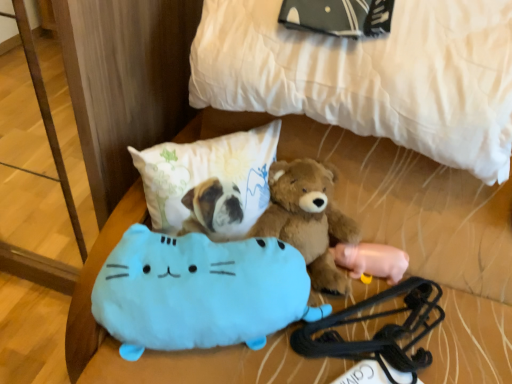
Question: Is white quilted bed at upper center wider than brown plush teddy bear at center?

Choices:
 (A) no
 (B) yes

Answer: (B)

Question: Is there a large distance between white quilted bed at upper center and brown plush teddy bear at center?

Choices:
 (A) no
 (B) yes

Answer: (A)

Question: Does white quilted bed at upper center come behind brown plush teddy bear at center?

Choices:
 (A) no
 (B) yes

Answer: (A)

Question: Considering the relative sizes of white quilted bed at upper center and brown plush teddy bear at center in the image provided, is white quilted bed at upper center smaller than brown plush teddy bear at center?

Choices:
 (A) no
 (B) yes

Answer: (A)

Question: Is white quilted bed at upper center at the right side of brown plush teddy bear at center?

Choices:
 (A) yes
 (B) no

Answer: (A)

Question: Is white quilted bed at upper center at the left side of brown plush teddy bear at center?

Choices:
 (A) no
 (B) yes

Answer: (A)

Question: Does pink rubber pig at lower right, placed as the first toy when sorted from back to front, have a greater height compared to fluffy white pillow at center?

Choices:
 (A) no
 (B) yes

Answer: (A)

Question: Could you tell me if pink rubber pig at lower right, acting as the 1th toy starting from the right, is facing fluffy white pillow at center?

Choices:
 (A) no
 (B) yes

Answer: (A)

Question: Could fluffy white pillow at center be considered to be inside pink rubber pig at lower right, acting as the 1th toy starting from the right?

Choices:
 (A) no
 (B) yes

Answer: (A)

Question: Is pink rubber pig at lower right, acting as the 2th toy starting from the front, at the right side of fluffy white pillow at center?

Choices:
 (A) no
 (B) yes

Answer: (B)

Question: Is pink rubber pig at lower right, acting as the 1th toy starting from the right, outside of fluffy white pillow at center?

Choices:
 (A) no
 (B) yes

Answer: (B)

Question: From the image's perspective, does pink rubber pig at lower right, acting as the 1th toy starting from the right, appear lower than fluffy white pillow at center?

Choices:
 (A) no
 (B) yes

Answer: (B)

Question: Does pink rubber pig at lower right, acting as the 2th toy starting from the front, come behind white quilted bed at upper center?

Choices:
 (A) yes
 (B) no

Answer: (A)